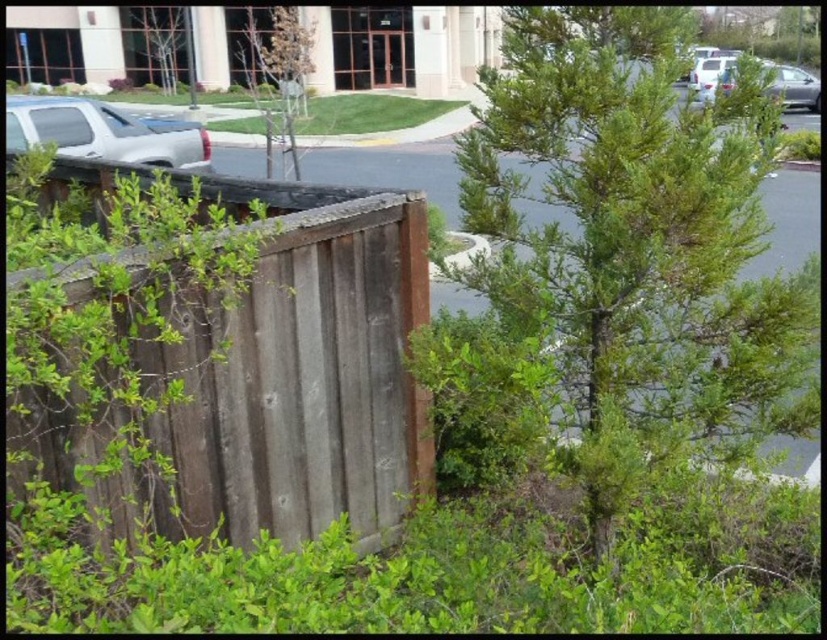
Question: Does weathered wood fence at left appear on the left side of silver metallic truck at left?

Choices:
 (A) yes
 (B) no

Answer: (B)

Question: Which point is closer to the camera taking this photo?

Choices:
 (A) [x=139, y=58]
 (B) [x=273, y=99]

Answer: (B)

Question: Which of the following is the closest to the observer?

Choices:
 (A) (259, 97)
 (B) (182, 44)
 (C) (183, 148)

Answer: (C)

Question: Is silver metallic truck at left thinner than green leafy tree at upper center?

Choices:
 (A) yes
 (B) no

Answer: (A)

Question: Can you confirm if weathered wood fence at left is positioned to the left of silver metallic truck at left?

Choices:
 (A) no
 (B) yes

Answer: (A)

Question: Which point is closer to the camera?

Choices:
 (A) (356, 442)
 (B) (65, 97)
 (C) (495, 282)
 (D) (140, 13)

Answer: (C)